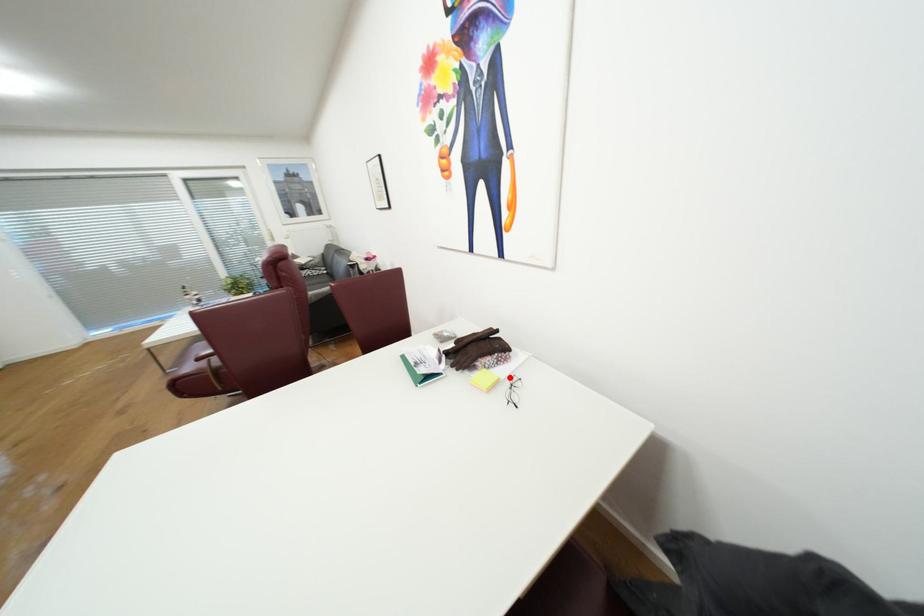
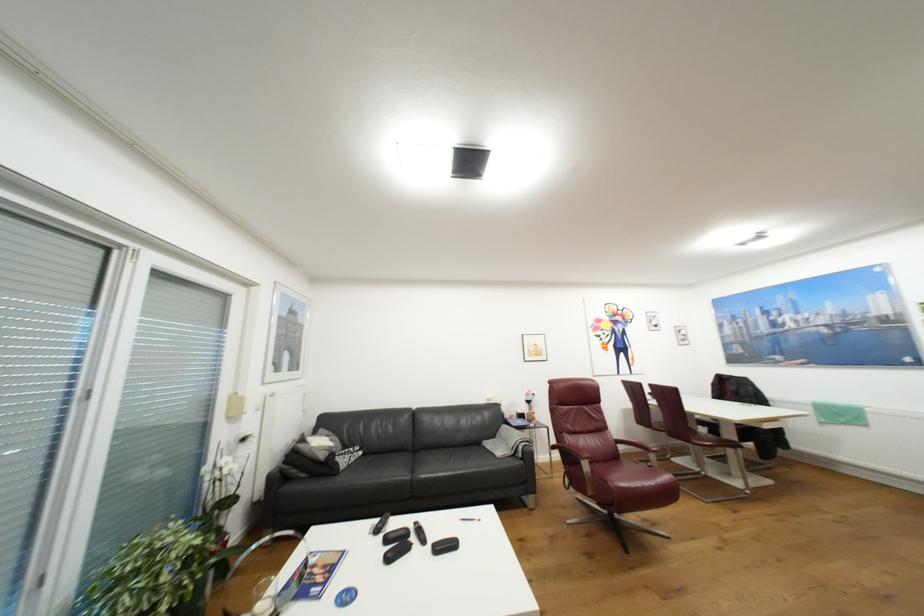
Question: I am providing you with two images of the same scene from different viewpoints. A red point is marked on the first image. Can you still see the location of the red point in image 2?

Choices:
 (A) Yes
 (B) No

Answer: (B)